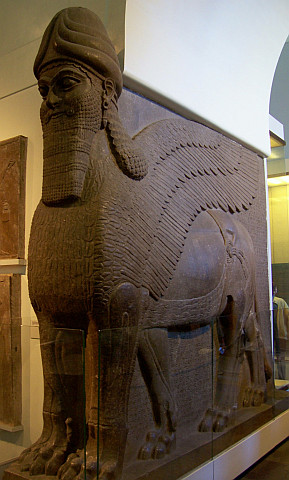
The image size is (289, 480). What are the coordinates of `floor` in the screenshot? It's located at (272, 467).